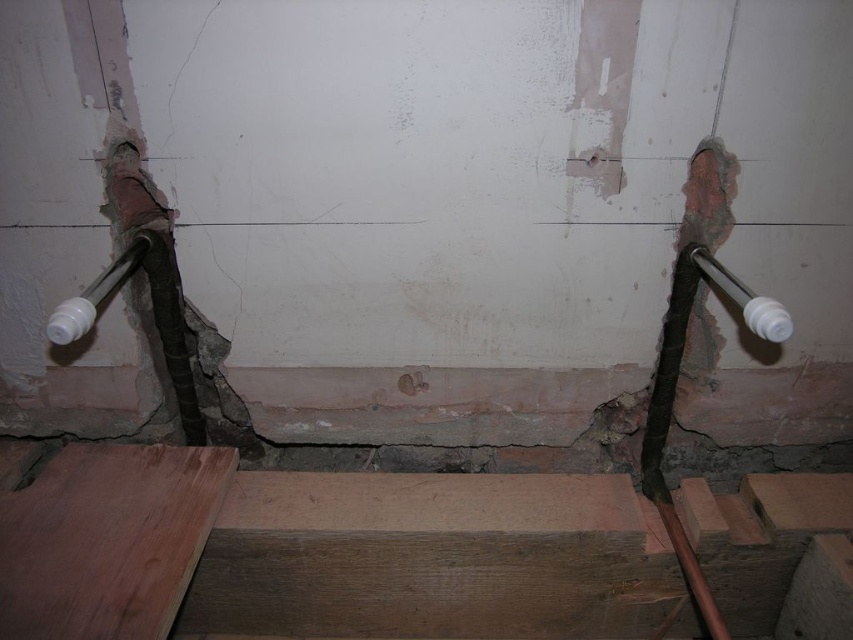
Question: Among these objects, which one is farthest from the camera?

Choices:
 (A) white plastic pipe at right
 (B) white plastic pipe at left

Answer: (B)

Question: Which point is closer to the camera?

Choices:
 (A) (761, 337)
 (B) (77, 321)

Answer: (B)

Question: Which point is farther to the camera?

Choices:
 (A) white plastic pipe at right
 (B) white plastic pipe at left

Answer: (B)

Question: Does white plastic pipe at left have a larger size compared to white plastic pipe at right?

Choices:
 (A) no
 (B) yes

Answer: (B)

Question: Can you confirm if white plastic pipe at left is positioned to the left of white plastic pipe at right?

Choices:
 (A) yes
 (B) no

Answer: (A)

Question: Does white plastic pipe at left appear over white plastic pipe at right?

Choices:
 (A) yes
 (B) no

Answer: (B)